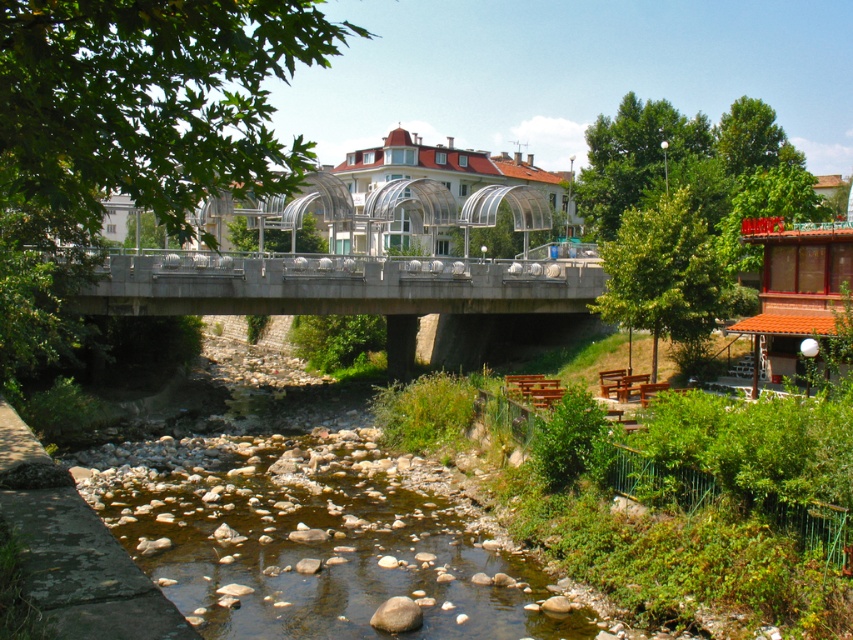
You are a bird flying over the urban landscape. You want to land on a tree that is higher up in the scene. Which tree should you choose between the green leafy tree at center and the green leafy tree at upper right?

The green leafy tree at center is located above the green leafy tree at upper right, so you should choose the green leafy tree at center to land on since it is higher up in the scene.

You are standing on the pedestrian bridge and want to locate two specific points in the image. The first point is at coordinates point (723, 182) and the second is at point (399, 627). From your current position on the bridge, which point is closer to you?

Point (399, 627) is closer to you since it is in front of point (723, 182) according to their positions.

You are standing at the starting point of the pedestrian bridge and want to reach the end of the bridge. Which point, point (16,122) or point (654,188), is closer to your current position?

Point (16,122) is closer to your current position because it is in front of point (654,188).